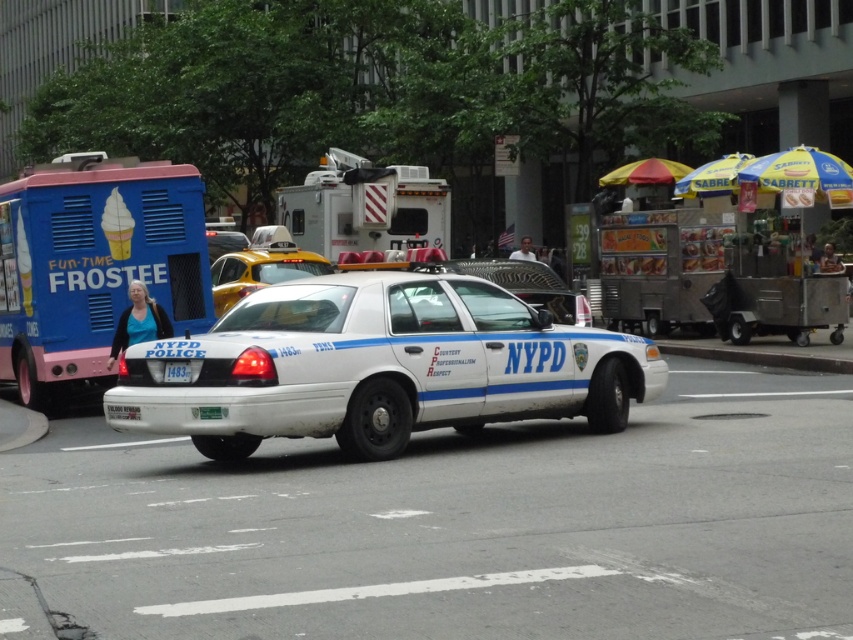
You are a pedestrian standing on the sidewalk and see the white plastic food truck at center and the yellowsmoothtaxi at center. Which one is higher up?

The white plastic food truck at center is located above the yellowsmoothtaxi at center, so it is higher up.

You are a delivery person needing to pass through the street. The white plastic food truck at center and the yellowsmoothtaxi at center are parked side by side. Which vehicle takes up more space horizontally?

The white plastic food truck at center is wider than the yellowsmoothtaxi at center, so it takes up more horizontal space.

You are a pedestrian standing on the sidewalk and see the blue painted ice cream truck at left and the white plastic license plate at center. Which object is closer to you?

The blue painted ice cream truck at left is closer to you because the white plastic license plate at center is behind it, meaning the truck is in front of the license plate.